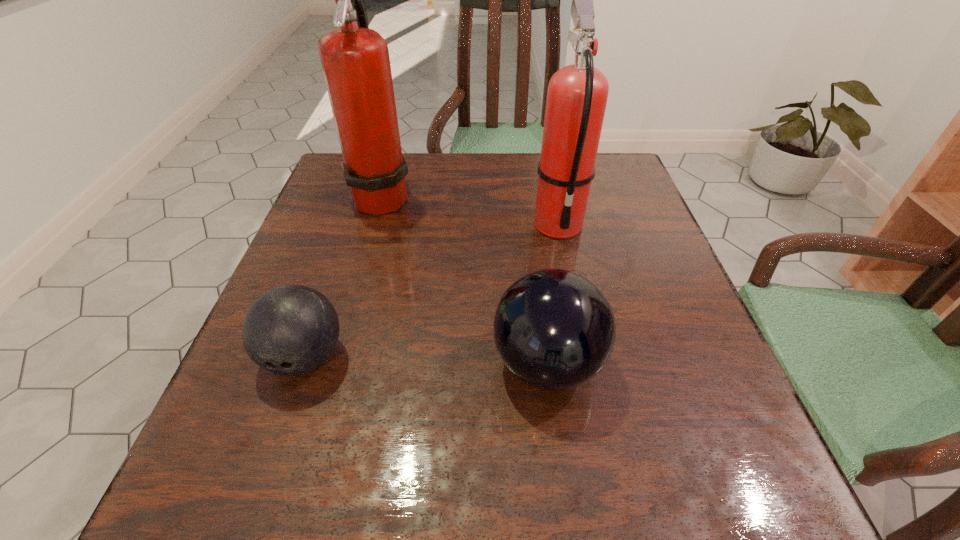
Identify the location of free spot between the left fire extinguisher and the right fire extinguisher. This screenshot has height=540, width=960. (470, 210).

The width and height of the screenshot is (960, 540). Find the location of `empty space between the left fire extinguisher and the shorter bowling ball`. empty space between the left fire extinguisher and the shorter bowling ball is located at coordinates (344, 276).

Identify the location of free point between the taller bowling ball and the left fire extinguisher. This screenshot has height=540, width=960. (465, 280).

I want to click on vacant space that is in between the right bowling ball and the left bowling ball, so click(x=426, y=361).

Image resolution: width=960 pixels, height=540 pixels. I want to click on object that can be found as the third closest to the shorter bowling ball, so click(577, 94).

Image resolution: width=960 pixels, height=540 pixels. In order to click on object that is the closest to the left bowling ball in this screenshot , I will do `click(555, 330)`.

This screenshot has height=540, width=960. Identify the location of free spot that satisfies the following two spatial constraints: 1. at the nozzle of the left fire extinguisher; 2. on the grip area of the shorter bowling ball. (336, 357).

Locate an element on the screen. This screenshot has width=960, height=540. free spot that satisfies the following two spatial constraints: 1. at the nozzle of the left fire extinguisher; 2. on the grip area of the shortest object is located at coordinates (336, 357).

Locate an element on the screen. The image size is (960, 540). free space that satisfies the following two spatial constraints: 1. at the nozzle of the left fire extinguisher; 2. on the grip area of the shortest object is located at coordinates (336, 357).

You are a GUI agent. You are given a task and a screenshot of the screen. Output one action in this format:
    pyautogui.click(x=<x>, y=<y>)
    Task: Click on the vacant region that satisfies the following two spatial constraints: 1. on the hose direction of the right fire extinguisher; 2. on the side of the right bowling ball with the finger holes
    This screenshot has height=540, width=960.
    Given the screenshot: What is the action you would take?
    pyautogui.click(x=588, y=364)